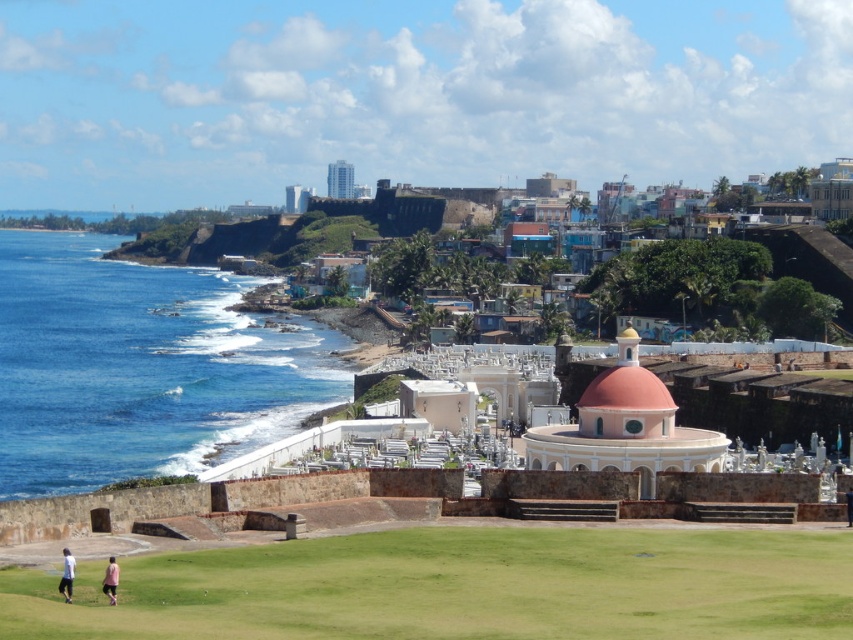
You are a photographer positioned at the lower left of the image. You want to capture both the white cotton shirt at lower left and the pink fabric person at lower left in a single frame. Which object should you focus on first to ensure both are in the frame?

You should focus on the white cotton shirt at lower left first because it is shorter than the pink fabric person at lower left, allowing the taller pink fabric person to still be within the frame when centered on the shorter object.